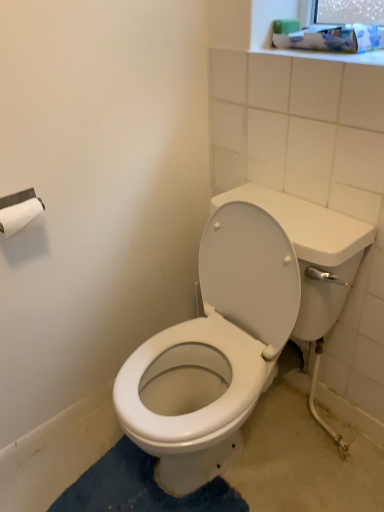
This screenshot has width=384, height=512. What are the coordinates of `blank space above blue carpet at lower left (from a real-world perspective)` in the screenshot? It's located at point(144,486).